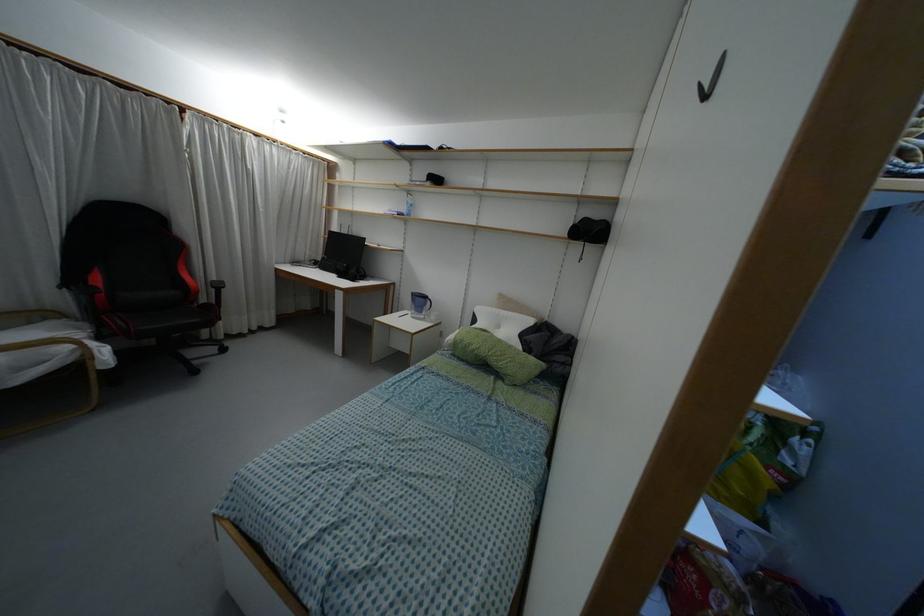
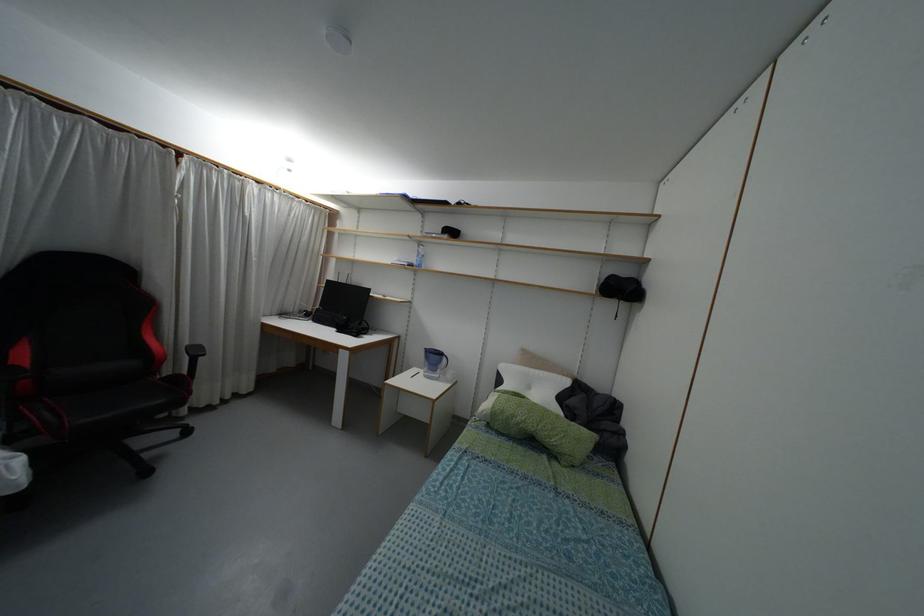
In a continuous first-person perspective shot, in which direction is the camera moving?

The cameraman walked toward left, forward.